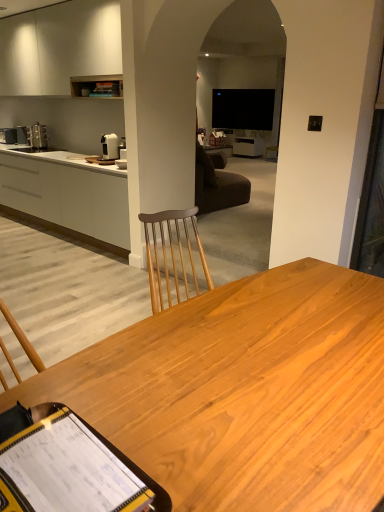
Question: Is white glossy coffee machine at upper left, which is counted as the second coffee machine, starting from the back, wider or thinner than white matte cabinetry at left, the 1th cabinetry when ordered from bottom to top?

Choices:
 (A) wide
 (B) thin

Answer: (B)

Question: Does point (109, 136) appear closer or farther from the camera than point (110, 218)?

Choices:
 (A) closer
 (B) farther

Answer: (B)

Question: Which of these objects is positioned closest to the yellow plastic clipboard at lower left?

Choices:
 (A) white matte cabinetry at left, the 1th cabinetry when ordered from bottom to top
 (B) satin silver coffee machine at left, positioned as the second coffee machine in bottom-to-top order
 (C) white glossy coffee machine at upper left, the 2th coffee machine when ordered from top to bottom
 (D) light brown wood desk at center
 (E) white matte cabinet at upper left, the second cabinetry in the bottom-to-top sequence

Answer: (D)

Question: Based on their relative distances, which object is farther from the satin silver coffee machine at left, arranged as the first coffee machine when viewed from the top?

Choices:
 (A) yellow plastic clipboard at lower left
 (B) white glossy coffee machine at upper left, which ranks as the first coffee machine in right-to-left order
 (C) white matte cabinet at upper left, which appears as the 1th cabinetry when viewed from the top
 (D) light brown wood desk at center
 (E) white matte cabinetry at left, the 1th cabinetry when ordered from bottom to top

Answer: (A)